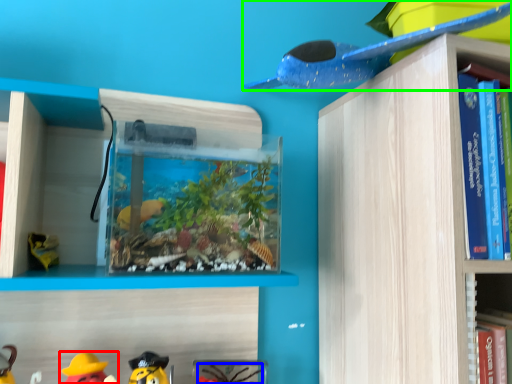
Question: Which is farther away from toy (highlighted by a red box)? toy (highlighted by a blue box) or toy (highlighted by a green box)?

Choices:
 (A) toy
 (B) toy

Answer: (B)